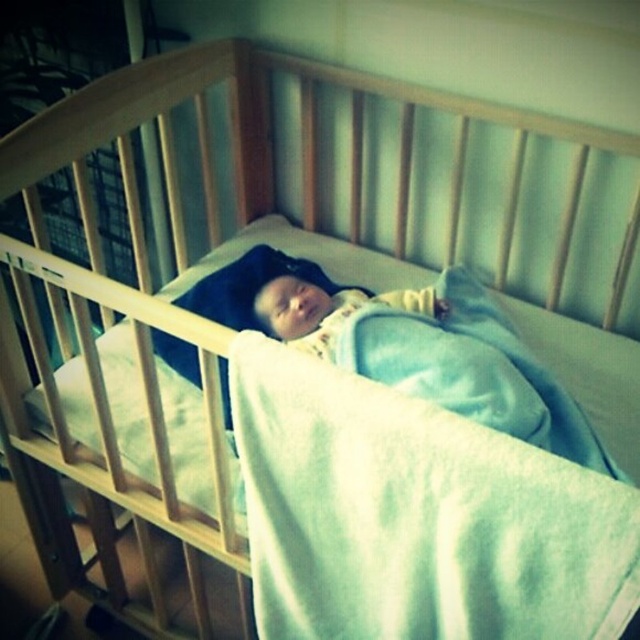
What do you see at coordinates (464, 365) in the screenshot? The height and width of the screenshot is (640, 640). I see `light blue soft blanket at center` at bounding box center [464, 365].

Is point (438, 308) farther from viewer compared to point (282, 301)?

Yes, it is.

Between point (369, 348) and point (342, 298), which one is positioned behind?

Point (342, 298)

Where is `light blue soft blanket at center`? light blue soft blanket at center is located at coordinates (464, 365).